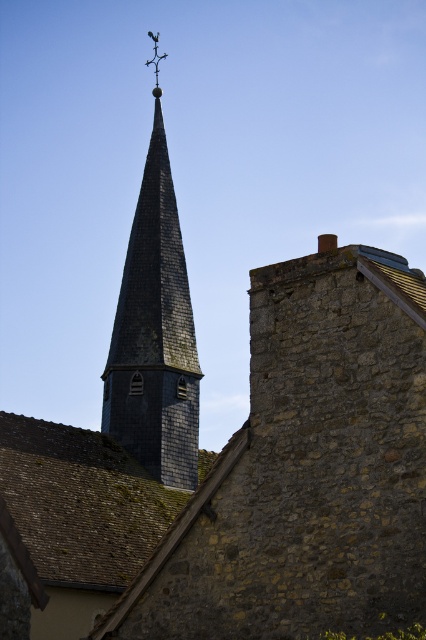
Is shiny dark gray slate church tower at center positioned at the back of metallic cross at upper center?

No, it is in front of metallic cross at upper center.

Which is in front, point (131, 438) or point (149, 61)?

Point (131, 438)

What are the coordinates of `shiny dark gray slate church tower at center` in the screenshot? It's located at (155, 336).